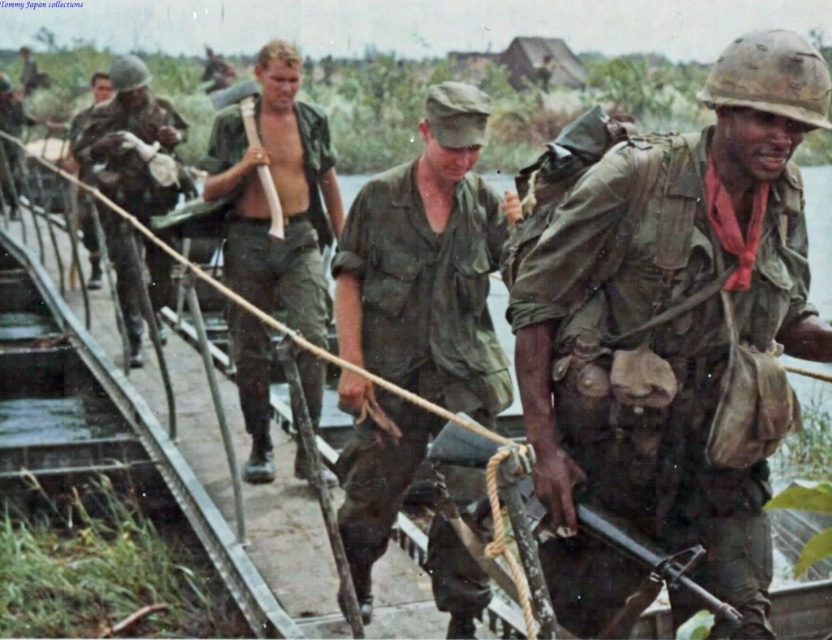
You are a soldier on the bridge and need to ensure your equipment is secure. Which item is positioned higher on your body between the camouflage fabric helmet at center and the green matte uniform at center?

The camouflage fabric helmet at center is positioned higher than the green matte uniform at center because it is located above it.

You are a soldier trying to cross the bridge and need to identify the item closest to you. Which one is closer to your viewpoint between the camouflage fabric helmet at center and the green matte uniform at center?

The camouflage fabric helmet at center is closer to your viewpoint because it is in front of the green matte uniform at center.

You are a soldier on the unstable bridge and need to retrieve your matte black rifle at center. However, you notice a camouflage fabric helmet at center in your way. Can you safely reach your rifle without moving the helmet?

The camouflage fabric helmet at center is further to the viewer than matte black rifle at center, so the rifle is actually behind the helmet. Since the helmet is in front of the rifle, you cannot safely reach the rifle without moving the helmet.